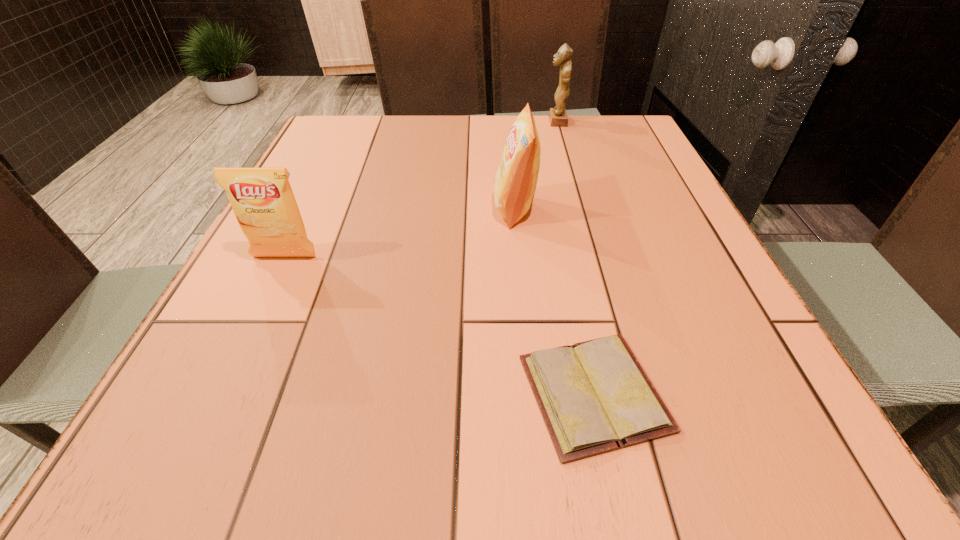
This screenshot has width=960, height=540. Find the location of `free space that satisfies the following two spatial constraints: 1. on the back side of the diary; 2. on the front-facing side of the farther crisp (potato chip)`. free space that satisfies the following two spatial constraints: 1. on the back side of the diary; 2. on the front-facing side of the farther crisp (potato chip) is located at coordinates (555, 209).